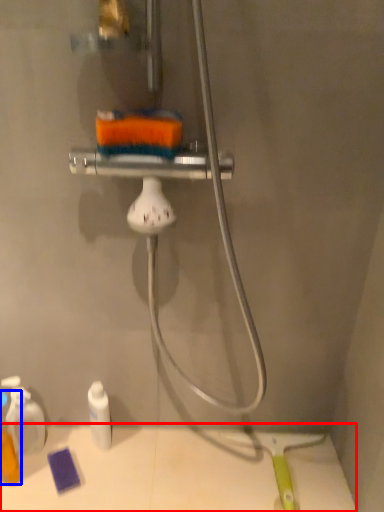
Question: Among these objects, which one is nearest to the camera, counter (highlighted by a red box) or toiletry (highlighted by a blue box)?

Choices:
 (A) counter
 (B) toiletry

Answer: (B)